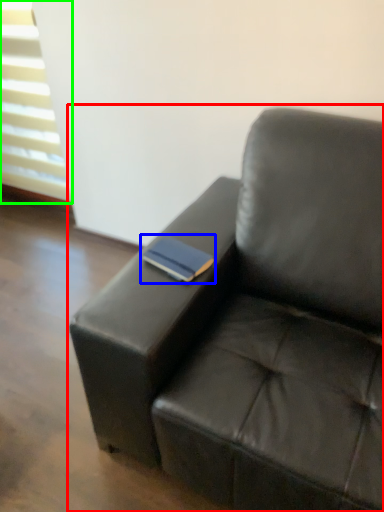
Question: Considering the real-world distances, which object is farthest from studio couch (highlighted by a red box)? paperback book (highlighted by a blue box) or window (highlighted by a green box)?

Choices:
 (A) paperback book
 (B) window

Answer: (B)